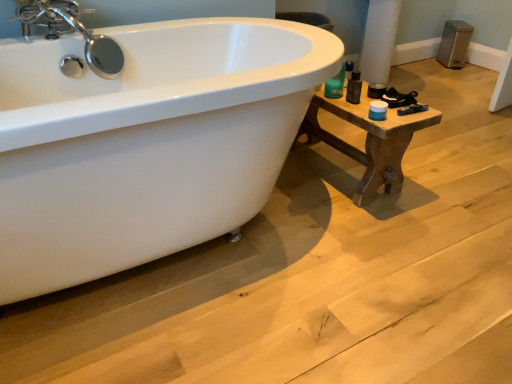
Identify the location of matte black container at right. This screenshot has width=512, height=384. (376, 90).

Measure the distance between brown wooden table at right and camera.

A distance of 4.84 feet exists between brown wooden table at right and camera.

Image resolution: width=512 pixels, height=384 pixels. I want to click on matte black container at right, so click(x=376, y=90).

From a real-world perspective, is chrome/metallic faucet at upper left over brown wooden table at right?

Yes.

Between chrome/metallic faucet at upper left and brown wooden table at right, which one is positioned behind?

brown wooden table at right is more distant.

Does chrome/metallic faucet at upper left have a greater width compared to brown wooden table at right?

No, chrome/metallic faucet at upper left is not wider than brown wooden table at right.

Measure the distance from brown wooden table at right to chrome/metallic faucet at upper left.

brown wooden table at right is 38.08 inches from chrome/metallic faucet at upper left.

Which object is closer to the camera taking this photo, brown wooden table at right or chrome/metallic faucet at upper left?

Positioned in front is chrome/metallic faucet at upper left.

Consider the image. From a real-world perspective, is brown wooden table at right above or below chrome/metallic faucet at upper left?

brown wooden table at right is below chrome/metallic faucet at upper left.

Does brown wooden table at right appear on the left side of chrome/metallic faucet at upper left?

No.

Which point is more forward, (78, 30) or (373, 88)?

The point (78, 30) is in front.

How many degrees apart are the facing directions of chrome/metallic faucet at upper left and matte black container at right?

The facing directions of chrome/metallic faucet at upper left and matte black container at right are 3.27 degrees apart.

Locate an element on the screen. toiletry on the right of chrome/metallic faucet at upper left is located at coordinates (376, 90).

Is chrome/metallic faucet at upper left positioned far away from matte black container at right?

That's right, there is a large distance between chrome/metallic faucet at upper left and matte black container at right.

Considering the sizes of matte black container at right and brown wooden table at right in the image, is matte black container at right bigger or smaller than brown wooden table at right?

Clearly, matte black container at right is smaller in size than brown wooden table at right.

Does matte black container at right have a greater height compared to brown wooden table at right?

No, matte black container at right is not taller than brown wooden table at right.

Which object is positioned more to the left, matte black container at right or brown wooden table at right?

From the viewer's perspective, brown wooden table at right appears more on the left side.

Which is closer to the camera, (x=341, y=111) or (x=373, y=95)?

The point (x=341, y=111) is closer.

Is matte black container at right completely or partially inside brown wooden table at right?

Definitely not — matte black container at right is not inside brown wooden table at right.

From the image's perspective, which one is positioned lower, brown wooden table at right or matte black container at right?

brown wooden table at right is shown below in the image.

Between matte black container at right and chrome/metallic faucet at upper left, which one is positioned behind?

matte black container at right is behind.

Is matte black container at right taller than chrome/metallic faucet at upper left?

In fact, matte black container at right may be shorter than chrome/metallic faucet at upper left.

Find the location of a particular element. The height and width of the screenshot is (384, 512). tap that is above the matte black container at right (from the image's perspective) is located at coordinates (72, 32).

Can you see matte black container at right touching chrome/metallic faucet at upper left?

matte black container at right and chrome/metallic faucet at upper left are not in contact.

Find the location of a particular element. tap located in front of the brown wooden table at right is located at coordinates (72, 32).

Find the location of a particular element. Image resolution: width=512 pixels, height=384 pixels. table that is behind the chrome/metallic faucet at upper left is located at coordinates (369, 141).

Looking at the image, which one is located further to chrome/metallic faucet at upper left, brown wooden table at right or matte black container at right?

Among the two, matte black container at right is located further to chrome/metallic faucet at upper left.

Based on their spatial positions, is chrome/metallic faucet at upper left or brown wooden table at right closer to matte black container at right?

The object closer to matte black container at right is brown wooden table at right.

Based on their spatial positions, is chrome/metallic faucet at upper left or matte black container at right further from brown wooden table at right?

Among the two, chrome/metallic faucet at upper left is located further to brown wooden table at right.

Considering their positions, is matte black container at right positioned further to chrome/metallic faucet at upper left than brown wooden table at right?

matte black container at right lies further to chrome/metallic faucet at upper left than the other object.

Estimate the real-world distances between objects in this image. Which object is closer to matte black container at right, brown wooden table at right or chrome/metallic faucet at upper left?

Based on the image, brown wooden table at right appears to be nearer to matte black container at right.

Estimate the real-world distances between objects in this image. Which object is further from brown wooden table at right, matte black container at right or chrome/metallic faucet at upper left?

chrome/metallic faucet at upper left is further to brown wooden table at right.

You are a GUI agent. You are given a task and a screenshot of the screen. Output one action in this format:
    pyautogui.click(x=<x>, y=<y>)
    Task: Click on the table located between chrome/metallic faucet at upper left and matte black container at right in the left-right direction
    The height and width of the screenshot is (384, 512).
    Given the screenshot: What is the action you would take?
    pyautogui.click(x=369, y=141)